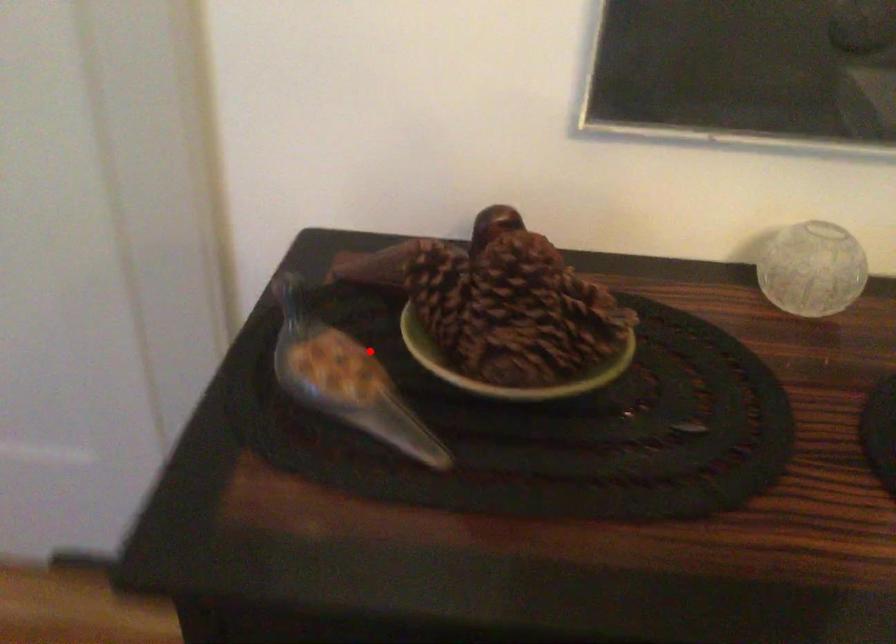
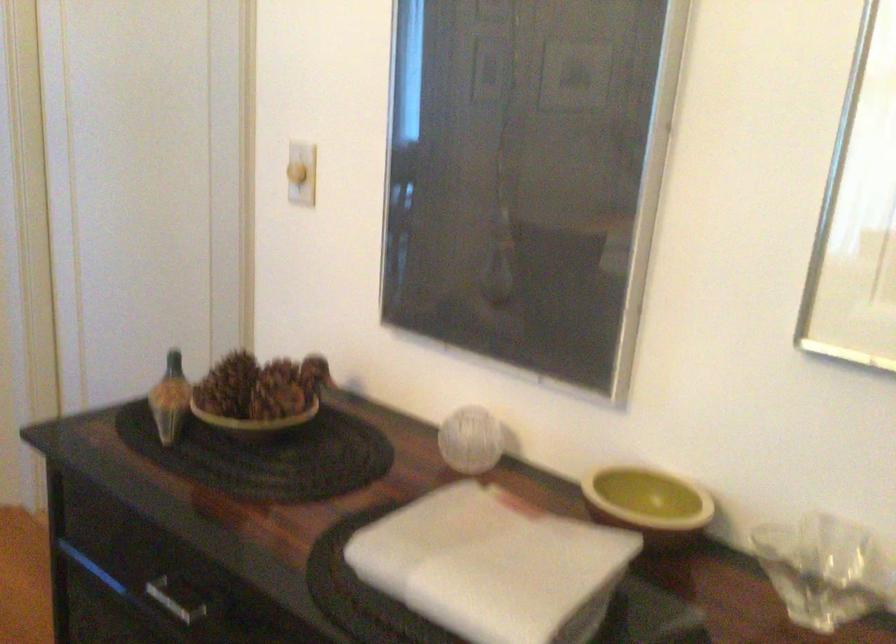
The point at the highlighted location is marked in the first image. Where is the corresponding point in the second image?

(169, 399)